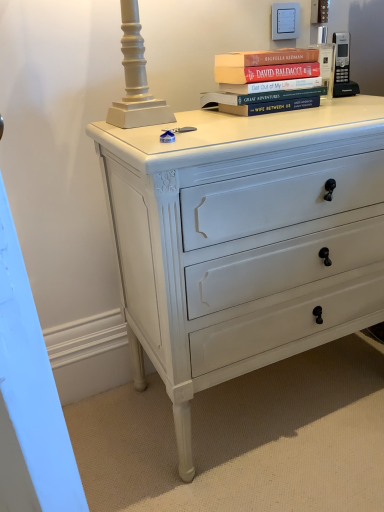
Question: Considering the relative sizes of black plastic phone at upper right and hardcover books at upper center in the image provided, is black plastic phone at upper right bigger than hardcover books at upper center?

Choices:
 (A) yes
 (B) no

Answer: (B)

Question: Considering the relative sizes of black plastic phone at upper right and hardcover books at upper center in the image provided, is black plastic phone at upper right wider than hardcover books at upper center?

Choices:
 (A) yes
 (B) no

Answer: (B)

Question: Does black plastic phone at upper right have a lesser width compared to hardcover books at upper center?

Choices:
 (A) no
 (B) yes

Answer: (B)

Question: From the image's perspective, would you say black plastic phone at upper right is shown under hardcover books at upper center?

Choices:
 (A) yes
 (B) no

Answer: (B)

Question: Is black plastic phone at upper right positioned beyond the bounds of hardcover books at upper center?

Choices:
 (A) yes
 (B) no

Answer: (A)

Question: Would you say black plastic phone at upper right is a long distance from hardcover books at upper center?

Choices:
 (A) yes
 (B) no

Answer: (B)

Question: Is hardcover books at upper center smaller than black plastic phone at upper right?

Choices:
 (A) no
 (B) yes

Answer: (A)

Question: Is hardcover books at upper center aimed at black plastic phone at upper right?

Choices:
 (A) no
 (B) yes

Answer: (A)

Question: Would you consider hardcover books at upper center to be distant from black plastic phone at upper right?

Choices:
 (A) yes
 (B) no

Answer: (B)

Question: Is the depth of hardcover books at upper center less than that of black plastic phone at upper right?

Choices:
 (A) yes
 (B) no

Answer: (A)

Question: Considering the relative sizes of hardcover books at upper center and black plastic phone at upper right in the image provided, is hardcover books at upper center bigger than black plastic phone at upper right?

Choices:
 (A) no
 (B) yes

Answer: (B)

Question: Does hardcover books at upper center lie behind black plastic phone at upper right?

Choices:
 (A) no
 (B) yes

Answer: (A)

Question: Considering the relative sizes of black plastic phone at upper right and white painted wood chest of drawers at center in the image provided, is black plastic phone at upper right smaller than white painted wood chest of drawers at center?

Choices:
 (A) yes
 (B) no

Answer: (A)